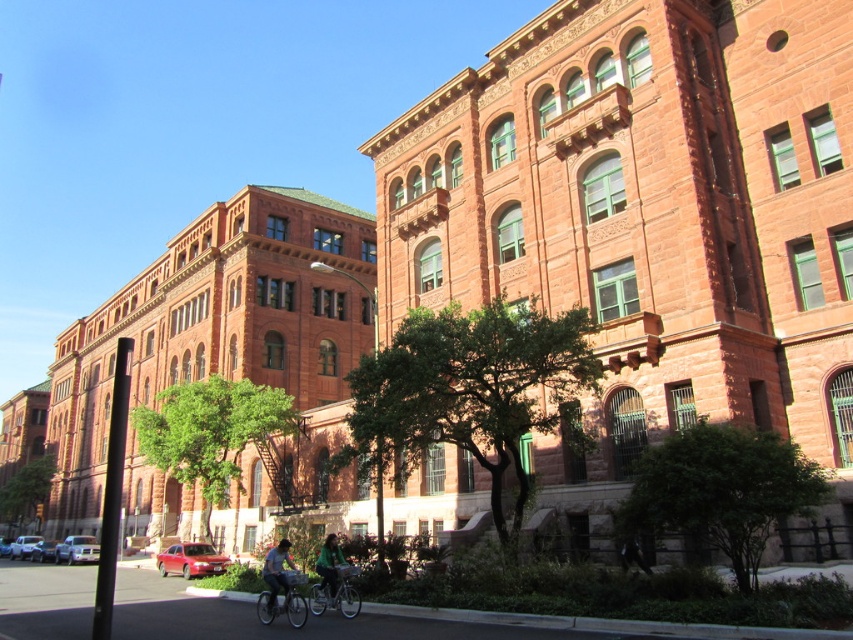
You are a delivery person who needs to park your green matte bicycle at center and your green fabric jacket at lower center near the historic brick buildings. Given the space constraints, which item should you place closer to the buildings to ensure they both fit within the available area?

The green matte bicycle at center is smaller than the green fabric jacket at lower center, so you should place the green fabric jacket at lower center closer to the buildings to accommodate the smaller bicycle in the remaining space.

You are standing at the point with coordinates (283, 600) in the image. What object are you standing on?

The point at (283, 600) corresponds to the silver metallic bicycle at lower center.

You are a delivery person trying to park your silver metallic bicycle at lower center next to the green matte jacket at lower center. Can the bicycle fit next to the jacket without overlapping?

The silver metallic bicycle at lower center is narrower than the green matte jacket at lower center, so it can fit next to the jacket without overlapping.